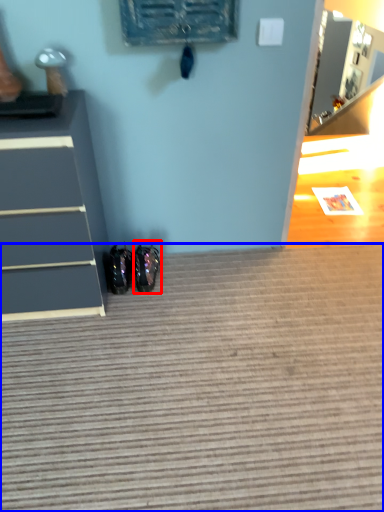
Question: Which object appears farthest to the camera in this image, footwear (highlighted by a red box) or doormat (highlighted by a blue box)?

Choices:
 (A) footwear
 (B) doormat

Answer: (A)